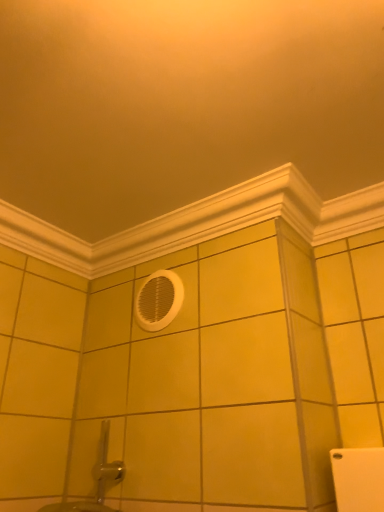
The height and width of the screenshot is (512, 384). What do you see at coordinates (159, 300) in the screenshot? I see `white plastic vent at center` at bounding box center [159, 300].

In order to click on white plastic vent at center in this screenshot , I will do `click(159, 300)`.

In order to face white plastic vent at center, should I rotate leftwards or rightwards?

To align with it, rotate left about 4.842°.

You are a GUI agent. You are given a task and a screenshot of the screen. Output one action in this format:
    pyautogui.click(x=<x>, y=<y>)
    Task: Click on the white plastic vent at center
    
    Given the screenshot: What is the action you would take?
    pyautogui.click(x=159, y=300)